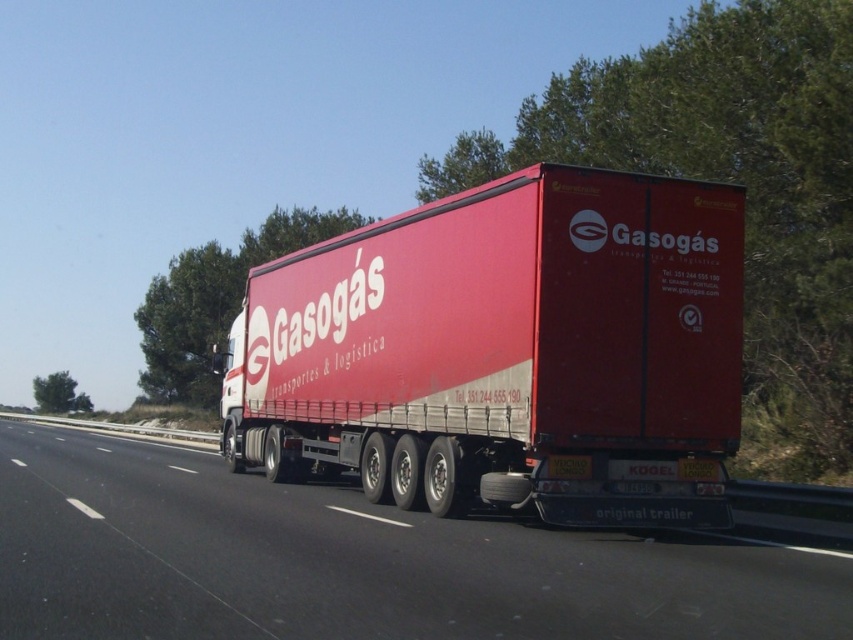
You are a GPS system guiding a car that is 2 meters wide. The car is currently on the highway and needs to overtake the matte red trailer truck at center. The GPS system knows the exact position of the truck represented by point [508,352]. Can the car safely overtake the truck if there is a 3 meter wide lane available?

The matte red trailer truck at center is represented by point [508,352]. Since the lane is 3 meters wide and the car is 2 meters wide, there is 1 meter of clearance remaining. This should provide enough space for the car to safely overtake the truck as long as speed and distance are properly managed.